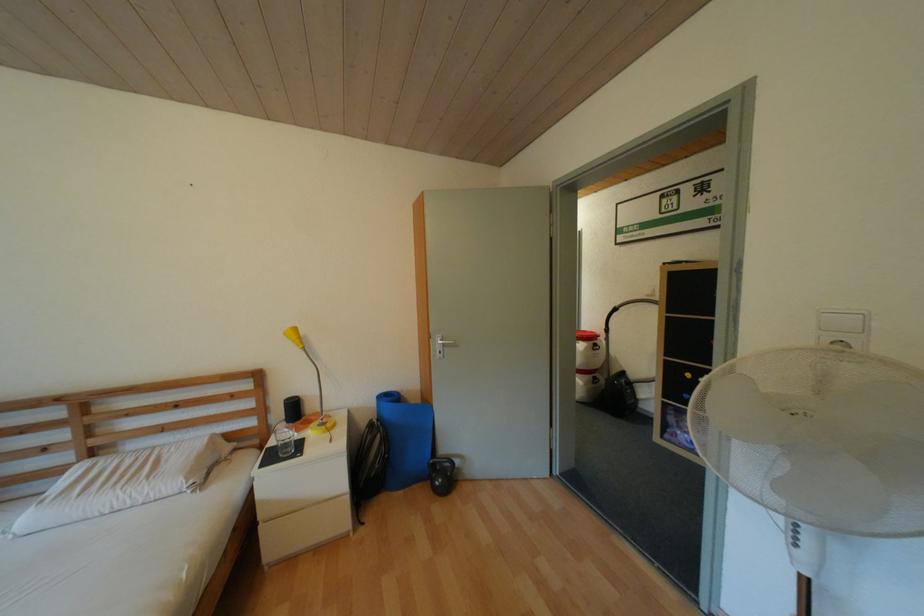
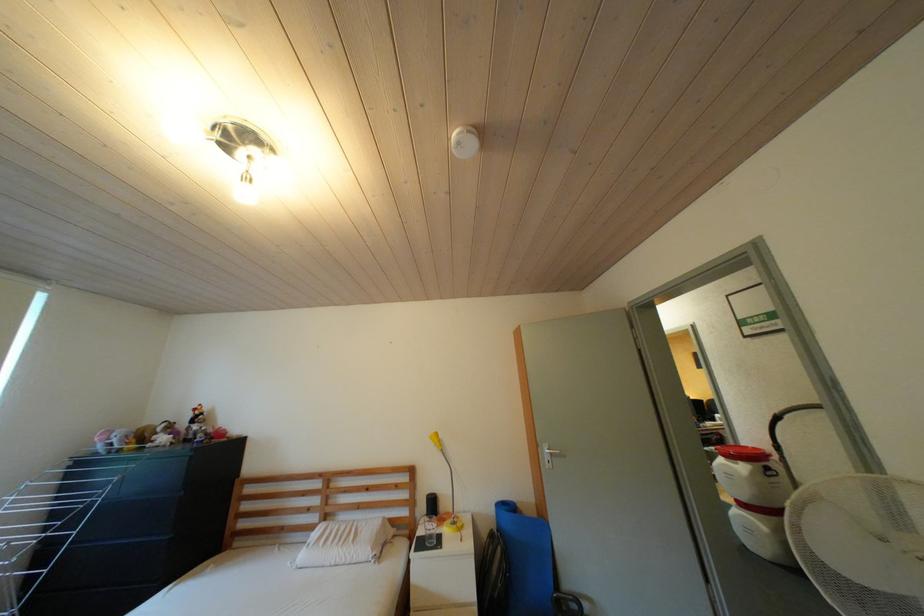
The point at (382, 405) is marked in the first image. Where is the corresponding point in the second image?

(502, 512)